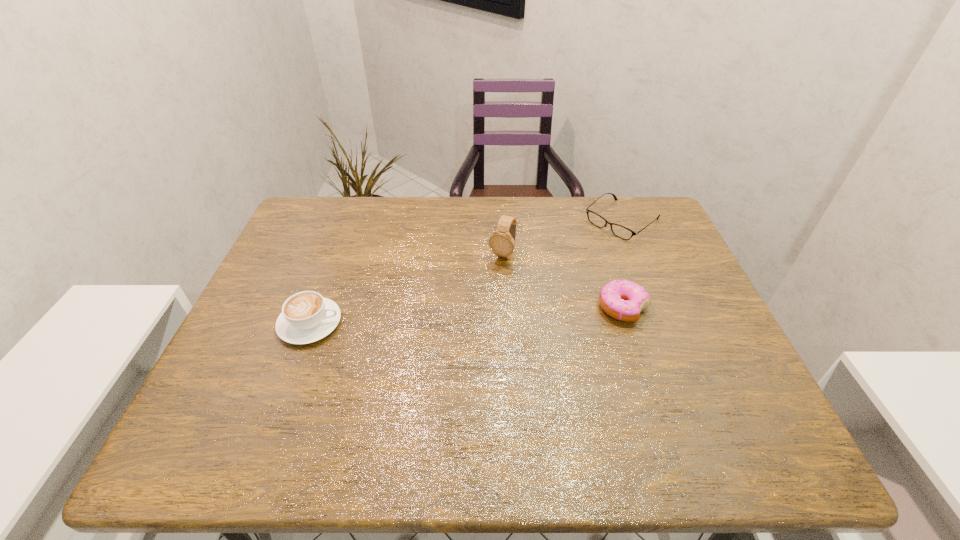
Identify the location of free space on the desktop that is between the leftmost object and the doughnut and is positioned on the front-facing side of the shortest object. The width and height of the screenshot is (960, 540). 502,314.

The image size is (960, 540). In order to click on vacant space on the desktop that is between the third shortest object and the doughnut and is positioned on the face of the tallest object in this screenshot , I will do `click(468, 315)`.